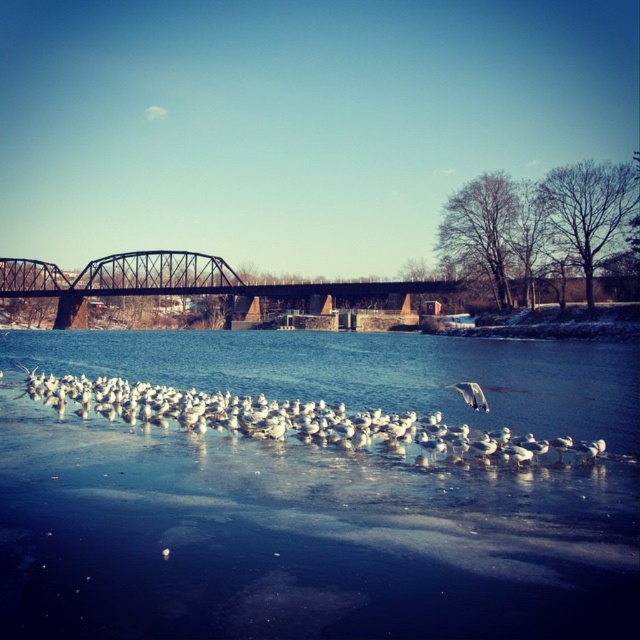
Question: Which point is closer to the camera taking this photo?

Choices:
 (A) (426, 458)
 (B) (301, 509)
 (C) (458, 388)

Answer: (B)

Question: Which point is farther from the camera taking this photo?

Choices:
 (A) (454, 385)
 (B) (54, 564)
 (C) (364, 413)

Answer: (A)

Question: Can you confirm if white feathered birds at center is thinner than dark brown metal bridge at center?

Choices:
 (A) yes
 (B) no

Answer: (A)

Question: Is dark brown metal bridge at center wider than white feathered bird at center?

Choices:
 (A) no
 (B) yes

Answer: (B)

Question: Does white ice at center have a lesser width compared to dark brown metal bridge at center?

Choices:
 (A) no
 (B) yes

Answer: (B)

Question: Based on their relative distances, which object is nearer to the white ice at center?

Choices:
 (A) white feathered birds at center
 (B) white feathered bird at center
 (C) dark brown metal bridge at center

Answer: (A)